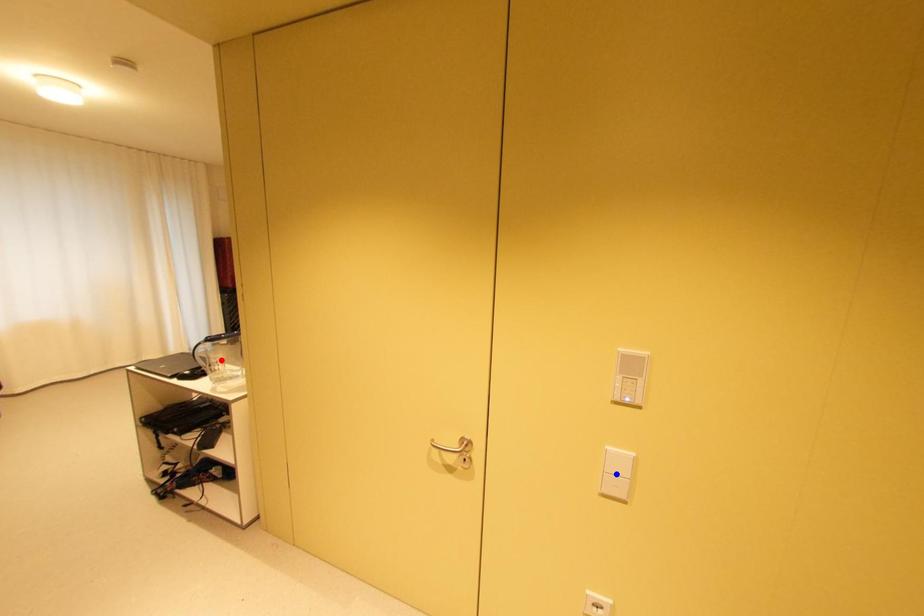
Question: In the image, two points are highlighted. Which point is nearer to the camera? Reply with the corresponding letter.

Choices:
 (A) blue point
 (B) red point

Answer: (A)